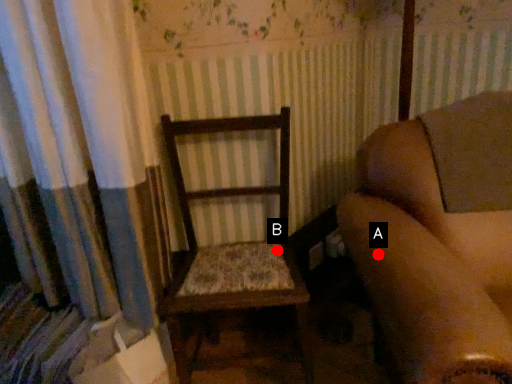
Question: Two points are circled on the image, labeled by A and B beside each circle. Which of the following is the farthest from the observer?

Choices:
 (A) A is further
 (B) B is further

Answer: (B)